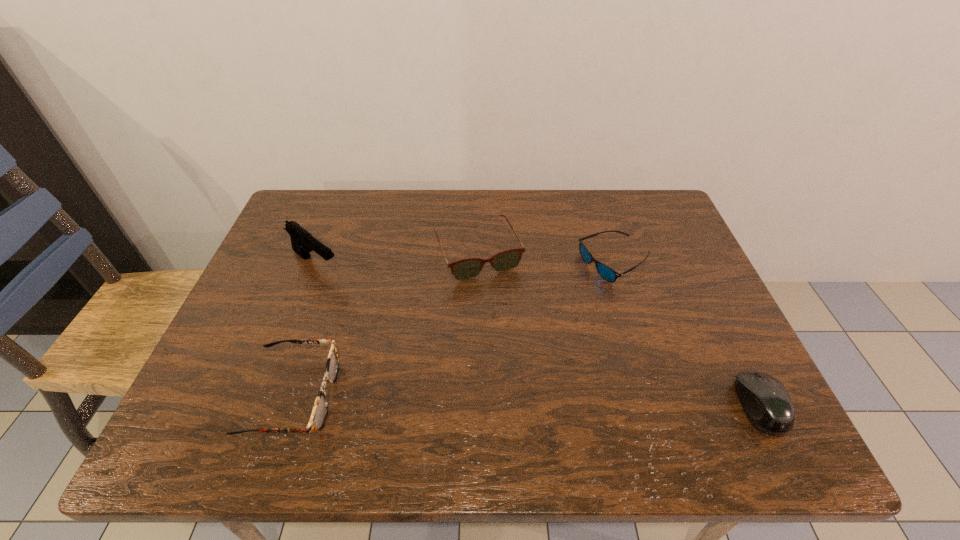
This screenshot has width=960, height=540. I want to click on the left spectacles, so click(320, 409).

The width and height of the screenshot is (960, 540). I want to click on mouse, so click(x=767, y=404).

At what (x,y) coordinates should I click in order to perform the action: click on the right spectacles. Please return your answer as a coordinate pair (x, y). This screenshot has width=960, height=540. Looking at the image, I should click on (468, 268).

I want to click on the third object from right to left, so click(x=468, y=268).

Where is `pistol`? pistol is located at coordinates (302, 241).

At what (x,y) coordinates should I click in order to perform the action: click on sunglasses. Please return your answer as a coordinate pair (x, y). This screenshot has height=540, width=960. Looking at the image, I should click on (607, 273).

Where is `the shortest object`? The image size is (960, 540). the shortest object is located at coordinates (607, 273).

Identify the location of vacant space located 0.340m on the frame of the left spectacles. The width and height of the screenshot is (960, 540). (497, 396).

This screenshot has width=960, height=540. Find the location of `free space located on the left of the rightmost object`. free space located on the left of the rightmost object is located at coordinates (543, 406).

At what (x,y) coordinates should I click in order to perform the action: click on vacant space located at the front view of the third object from right to left. Please return your answer as a coordinate pair (x, y). This screenshot has width=960, height=540. Looking at the image, I should click on (517, 339).